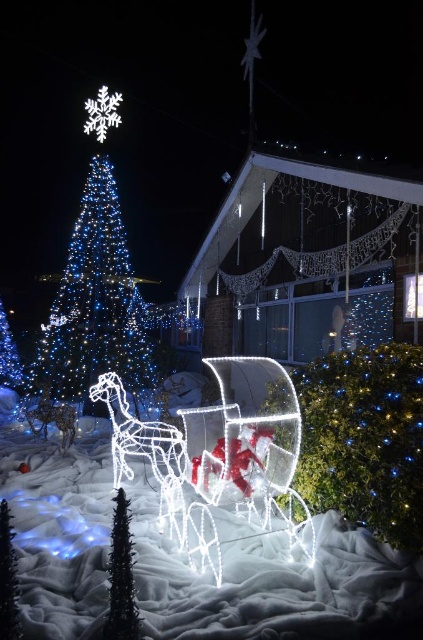
Can you confirm if illuminated plastic tree at upper left is smaller than black matte christmas tree at lower left?

No.

Can you confirm if illuminated plastic tree at upper left is wider than black matte christmas tree at lower left?

Yes.

Describe the element at coordinates (93, 304) in the screenshot. The image size is (423, 640). I see `illuminated plastic tree at upper left` at that location.

The width and height of the screenshot is (423, 640). In order to click on illuminated plastic tree at upper left in this screenshot , I will do `click(93, 304)`.

Between point (420, 506) and point (123, 550), which one is positioned in front?

Point (123, 550) is more forward.

Does illuminated plastic tree at center have a smaller size compared to black matte christmas tree at lower left?

No.

Is point (411, 420) in front of point (112, 499)?

Yes.

Locate an element on the screen. This screenshot has width=423, height=640. illuminated plastic tree at center is located at coordinates (365, 440).

The image size is (423, 640). What do you see at coordinates (365, 440) in the screenshot? I see `illuminated plastic tree at center` at bounding box center [365, 440].

Is point (412, 481) behind point (106, 282)?

No, it is in front of (106, 282).

Does point (390, 488) lie behind point (65, 394)?

No, it is in front of (65, 394).

At what (x,y) coordinates should I click in order to perform the action: click on illuminated plastic tree at center. Please return your answer as a coordinate pair (x, y). Looking at the image, I should click on tap(365, 440).